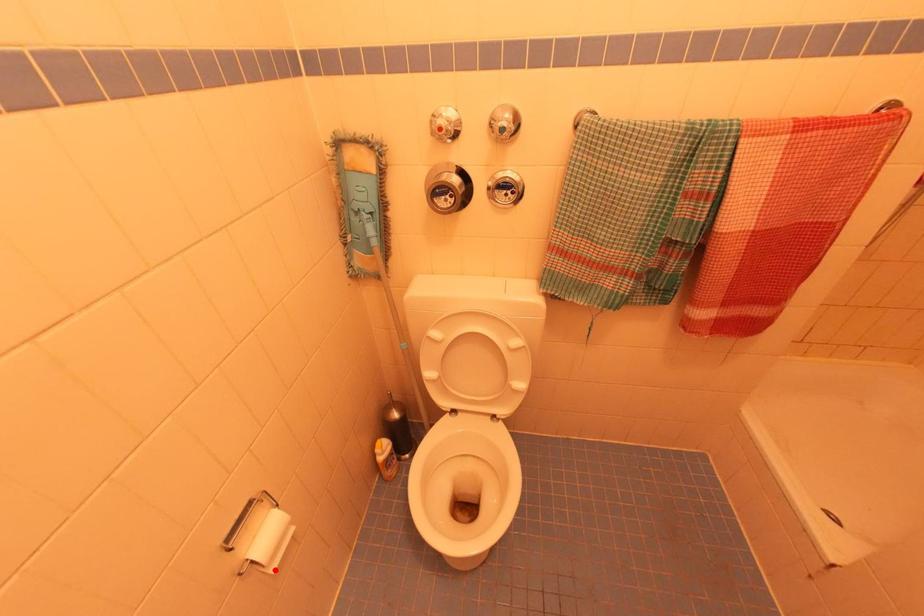
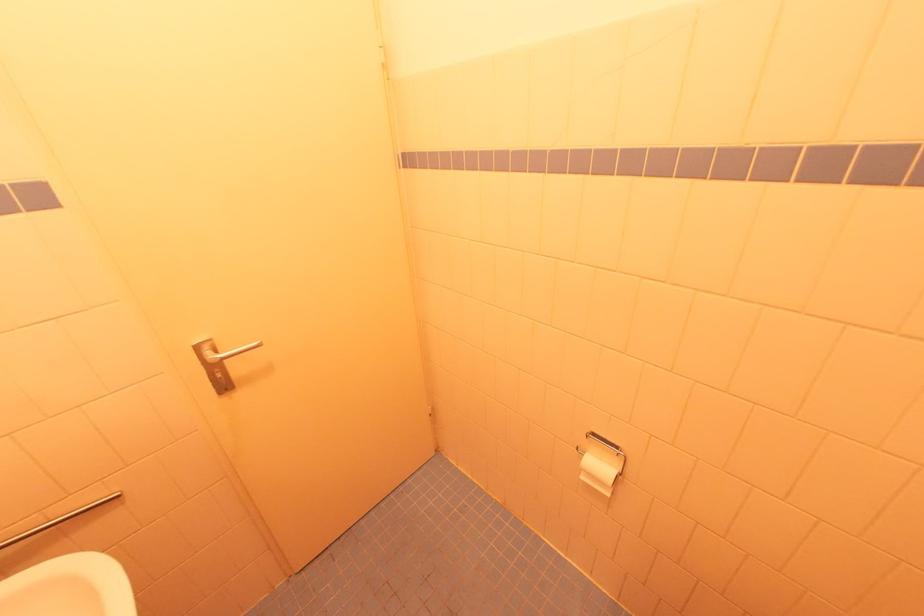
Question: A red point is marked in image1. In image2, is the corresponding 3D point closer to the camera or farther? Reply with the corresponding letter.

Choices:
 (A) The corresponding 3D point is closer.
 (B) The corresponding 3D point is farther.

Answer: (B)